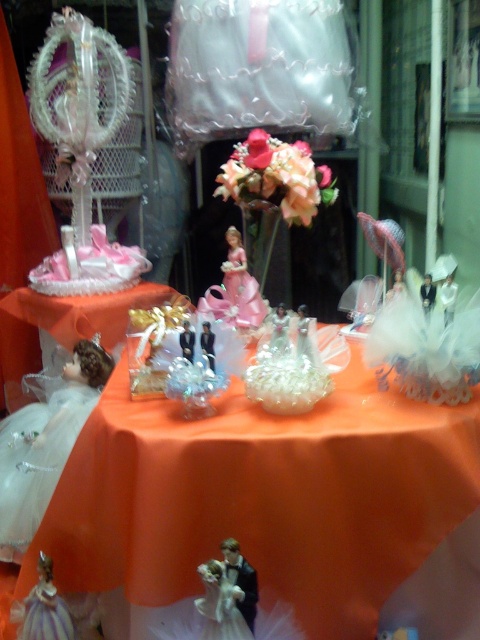
Is orange satin tablecloth at center closer to camera compared to pink silk flower at center?

Yes, orange satin tablecloth at center is closer to the viewer.

Does orange satin tablecloth at center have a lesser width compared to pink silk flower at center?

No.

Find the location of a particular element. orange satin tablecloth at center is located at coordinates point(271,493).

Is point (49, 396) more distant than point (206, 342)?

Yes, point (49, 396) is behind point (206, 342).

Between translucent white doll at lower left and matte gold figurine at center, which one appears on the right side from the viewer's perspective?

matte gold figurine at center is more to the right.

Does point (76, 417) come closer to viewer compared to point (207, 332)?

No.

Where is `translucent white doll at lower left`? translucent white doll at lower left is located at coordinates (45, 444).

From the picture: Who is positioned more to the left, orange satin tablecloth at center or matte black figurine at center?

matte black figurine at center

Does orange satin tablecloth at center have a lesser height compared to matte black figurine at center?

No.

What do you see at coordinates (271, 493) in the screenshot? I see `orange satin tablecloth at center` at bounding box center [271, 493].

Locate an element on the screen. orange satin tablecloth at center is located at coordinates (271, 493).